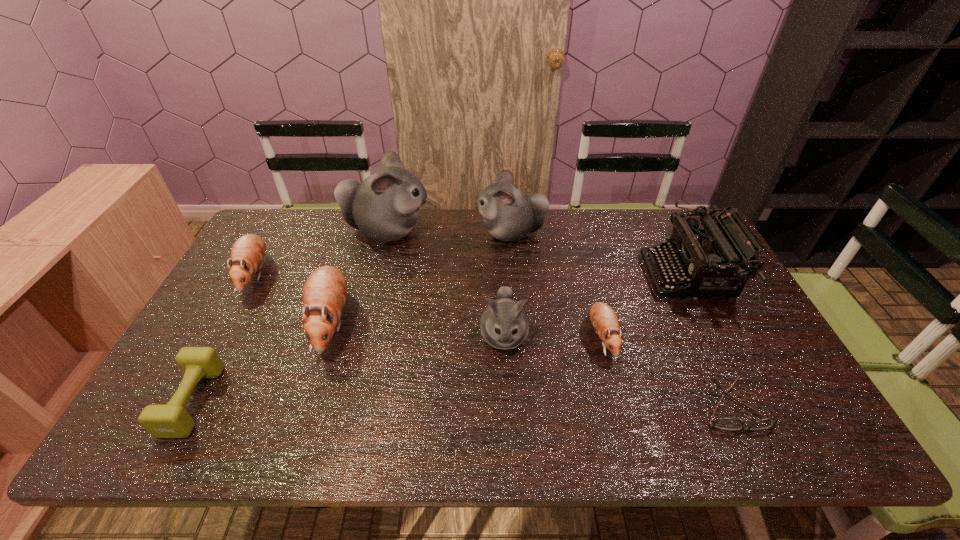
You are a GUI agent. You are given a task and a screenshot of the screen. Output one action in this format:
    pyautogui.click(x=<x>, y=<y>)
    Task: Click on the object that is the seventh closest to the smallest white hamster
    The height and width of the screenshot is (540, 960).
    Given the screenshot: What is the action you would take?
    pyautogui.click(x=171, y=420)

Where is `object that stands as the closest to the typewriter`? The image size is (960, 540). object that stands as the closest to the typewriter is located at coordinates (604, 319).

The image size is (960, 540). I want to click on hamster object that ranks as the closest to the biggest white hamster, so click(509, 214).

I want to click on hamster that is the fourth closest to the shortest hamster, so click(324, 294).

Identify which white hamster is located as the third nearest to the shortest object. Please provide its 2D coordinates. Your answer should be formatted as a tuple, i.e. [(x, y)], where the tuple contains the x and y coordinates of a point satisfying the conditions above.

[(385, 206)]

Find the location of a particular element. This screenshot has height=540, width=960. the second closest white hamster relative to the smallest brown hamster is located at coordinates (509, 214).

The height and width of the screenshot is (540, 960). What are the coordinates of `brown hamster identified as the closest to the fifth tallest hamster` in the screenshot? It's located at (324, 294).

This screenshot has width=960, height=540. I want to click on the third closest brown hamster to the shortest object, so click(247, 254).

At what (x,y) coordinates should I click in order to perform the action: click on blank space that satisfies the following two spatial constraints: 1. on the face of the tallest object; 2. at the face of the fifth tallest hamster. Please return your answer as a coordinate pair (x, y). Image resolution: width=960 pixels, height=540 pixels. Looking at the image, I should click on (376, 275).

Identify the location of free location that satisfies the following two spatial constraints: 1. on the face of the leftmost white hamster; 2. at the face of the biggest brown hamster. (364, 322).